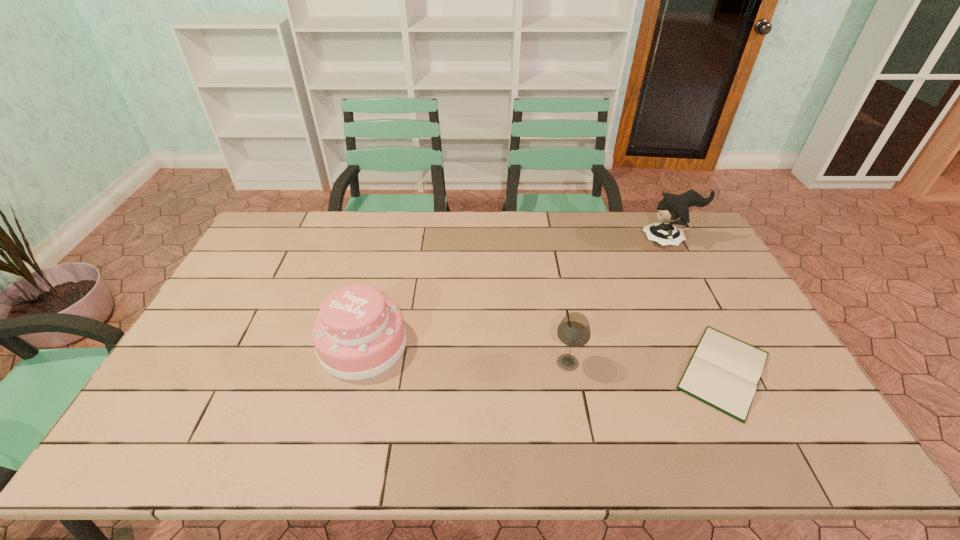
Image resolution: width=960 pixels, height=540 pixels. I want to click on free region that satisfies the following two spatial constraints: 1. at the face of the doll; 2. on the front side of the wineglass, so click(x=733, y=362).

Where is `free region that satisfies the following two spatial constraints: 1. at the face of the farthest object; 2. on the front side of the wineglass`? free region that satisfies the following two spatial constraints: 1. at the face of the farthest object; 2. on the front side of the wineglass is located at coordinates (733, 362).